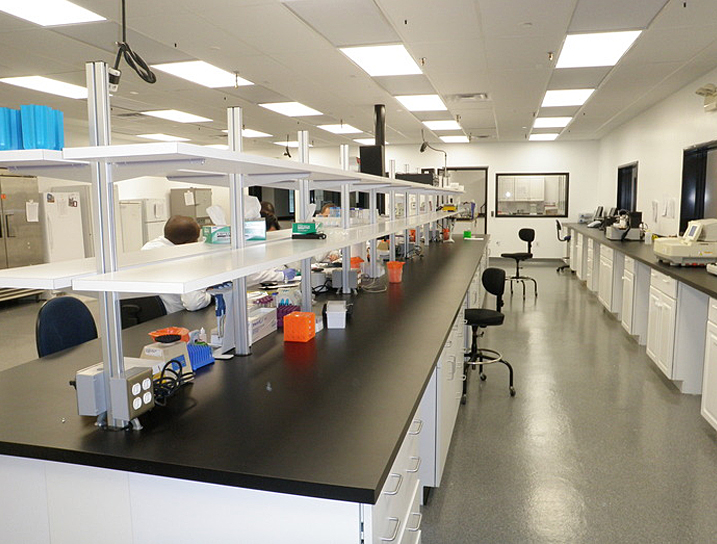
Locate an element on the screen. floor is located at coordinates (571, 430), (18, 337).